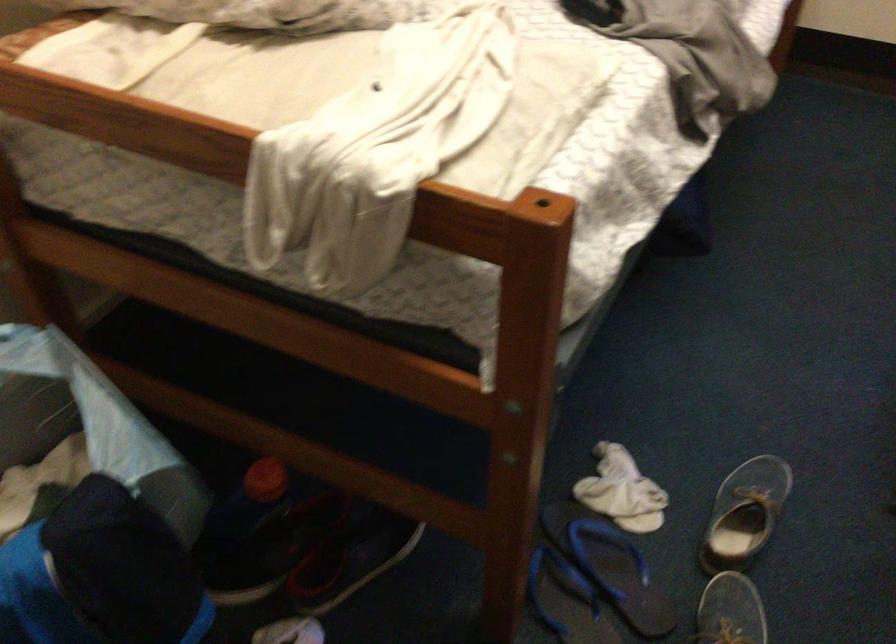
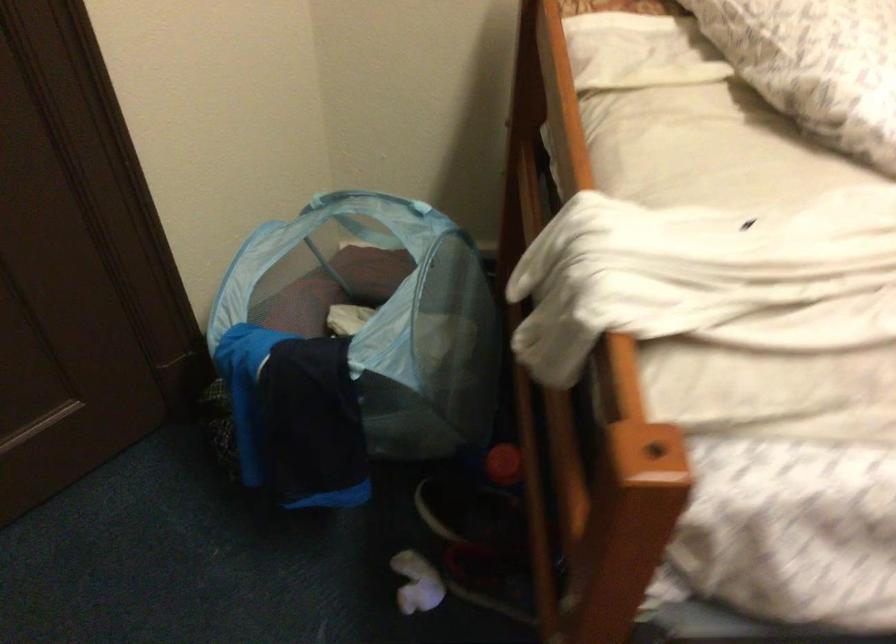
In the second image, find the point that corresponds to [270,471] in the first image.

(504, 464)